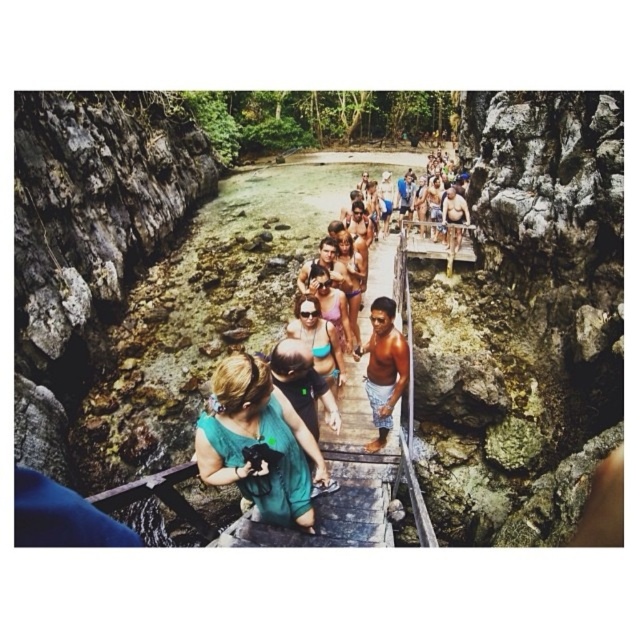
Is teal fabric top at center bigger than matte pink bikini at center?

Correct, teal fabric top at center is larger in size than matte pink bikini at center.

Can you confirm if teal fabric top at center is positioned to the left of matte pink bikini at center?

Yes, teal fabric top at center is to the left of matte pink bikini at center.

Does point (257, 371) lie in front of point (324, 284)?

That is True.

Find the location of `teal fabric top at center`. teal fabric top at center is located at coordinates (259, 444).

Between point (384, 340) and point (323, 285), which one is positioned behind?

Positioned behind is point (323, 285).

This screenshot has height=640, width=640. What are the coordinates of `shiny brown shorts at center` in the screenshot? It's located at (384, 368).

Does teal fabric top at center appear over shiny brown shorts at center?

No, teal fabric top at center is not above shiny brown shorts at center.

Based on the photo, is teal fabric top at center wider than shiny brown shorts at center?

Correct, the width of teal fabric top at center exceeds that of shiny brown shorts at center.

Which is behind, point (211, 410) or point (380, 317)?

Positioned behind is point (380, 317).

Find the location of a particular element. This screenshot has height=640, width=640. teal fabric top at center is located at coordinates (259, 444).